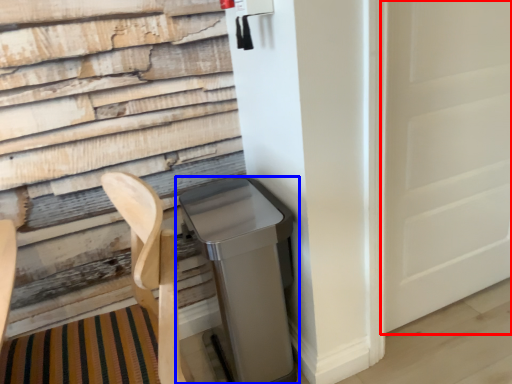
Question: Which point is closer to the camera, screen door (highlighted by a red box) or waste container (highlighted by a blue box)?

Choices:
 (A) screen door
 (B) waste container

Answer: (B)